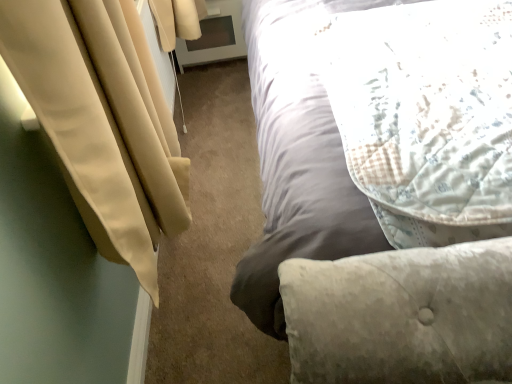
Question: Can you confirm if light gray fabric bed at upper right is smaller than beige fabric curtain at left?

Choices:
 (A) yes
 (B) no

Answer: (B)

Question: Is light gray fabric bed at upper right outside of beige fabric curtain at left?

Choices:
 (A) no
 (B) yes

Answer: (B)

Question: Does light gray fabric bed at upper right contain beige fabric curtain at left?

Choices:
 (A) yes
 (B) no

Answer: (B)

Question: From the image's perspective, would you say light gray fabric bed at upper right is positioned over beige fabric curtain at left?

Choices:
 (A) no
 (B) yes

Answer: (B)

Question: Is light gray fabric bed at upper right wider than beige fabric curtain at left?

Choices:
 (A) no
 (B) yes

Answer: (B)

Question: Is light gray fabric bed at upper right taller or shorter than fluffy white pillow at upper right?

Choices:
 (A) short
 (B) tall

Answer: (B)

Question: Is point (287, 309) closer or farther from the camera than point (415, 235)?

Choices:
 (A) closer
 (B) farther

Answer: (A)

Question: Based on their positions, is light gray fabric bed at upper right located to the left or right of fluffy white pillow at upper right?

Choices:
 (A) left
 (B) right

Answer: (B)

Question: From the image's perspective, is light gray fabric bed at upper right above or below fluffy white pillow at upper right?

Choices:
 (A) above
 (B) below

Answer: (A)

Question: Is fluffy white pillow at upper right bigger or smaller than light gray fabric bed at upper right?

Choices:
 (A) small
 (B) big

Answer: (A)

Question: Is fluffy white pillow at upper right wider or thinner than light gray fabric bed at upper right?

Choices:
 (A) thin
 (B) wide

Answer: (A)

Question: Visually, is fluffy white pillow at upper right positioned to the left or to the right of light gray fabric bed at upper right?

Choices:
 (A) left
 (B) right

Answer: (A)

Question: Is point click(472, 211) positioned closer to the camera than point click(287, 332)?

Choices:
 (A) farther
 (B) closer

Answer: (A)

Question: Visually, is beige fabric curtain at left positioned to the left or to the right of light gray fabric bed at upper right?

Choices:
 (A) right
 (B) left

Answer: (B)

Question: Based on their sizes in the image, would you say beige fabric curtain at left is bigger or smaller than light gray fabric bed at upper right?

Choices:
 (A) big
 (B) small

Answer: (B)